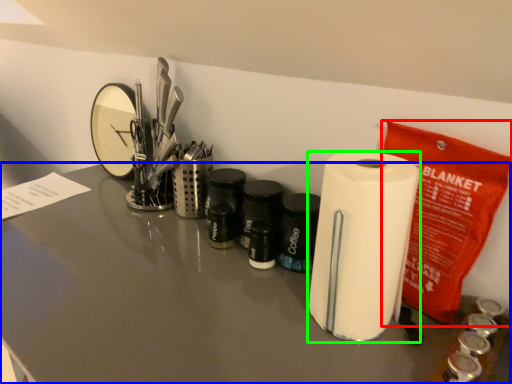
Question: Considering the real-world distances, which object is closest to stationery (highlighted by a red box)? counter top (highlighted by a blue box) or paper towel (highlighted by a green box).

Choices:
 (A) counter top
 (B) paper towel

Answer: (B)